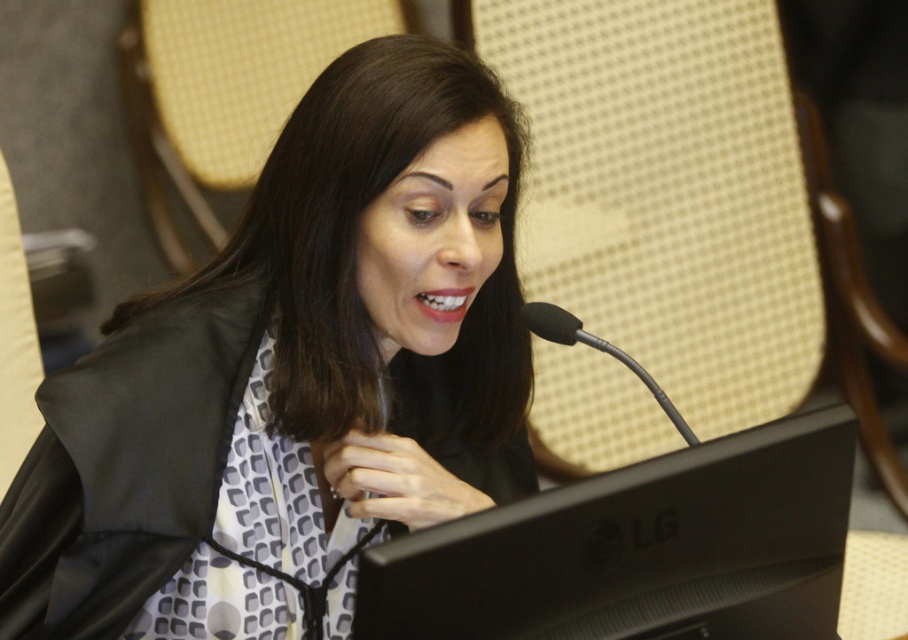
Question: Which point is farther to the camera?

Choices:
 (A) (469, 448)
 (B) (814, 524)

Answer: (A)

Question: Is black matte jacket at center below black matte computer screen at center?

Choices:
 (A) yes
 (B) no

Answer: (B)

Question: Among these objects, which one is nearest to the camera?

Choices:
 (A) black matte jacket at center
 (B) black metallic microphone at center

Answer: (B)

Question: Which of the following is the farthest from the observer?

Choices:
 (A) black matte computer screen at center
 (B) black metallic microphone at center

Answer: (B)

Question: Can you confirm if black matte jacket at center is thinner than black matte computer screen at center?

Choices:
 (A) yes
 (B) no

Answer: (B)

Question: Does black matte jacket at center have a greater width compared to black metallic microphone at center?

Choices:
 (A) yes
 (B) no

Answer: (A)